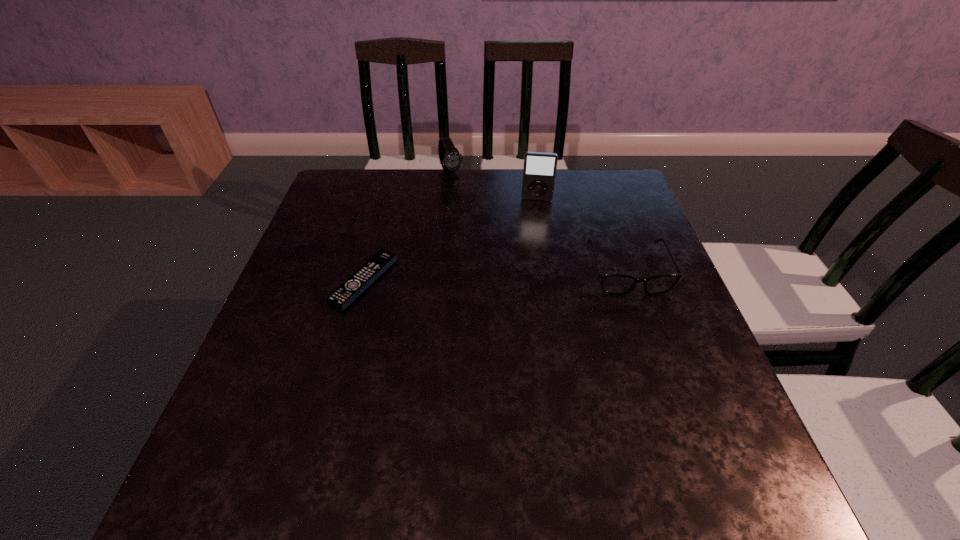
The image size is (960, 540). In order to click on free space between the spectacles and the tallest object in this screenshot , I will do `click(582, 235)`.

Identify the location of empty space between the watch and the remote control. The image size is (960, 540). (408, 229).

Where is `empty location between the third object from right to left and the remote control`? The height and width of the screenshot is (540, 960). empty location between the third object from right to left and the remote control is located at coordinates (408, 229).

At what (x,y) coordinates should I click in order to perform the action: click on blank region between the third object from right to left and the rightmost object. Please return your answer as a coordinate pair (x, y). Image resolution: width=960 pixels, height=540 pixels. Looking at the image, I should click on (540, 224).

Image resolution: width=960 pixels, height=540 pixels. What are the coordinates of `free space between the remote control and the third object from right to left` in the screenshot? It's located at click(408, 229).

You are a GUI agent. You are given a task and a screenshot of the screen. Output one action in this format:
    pyautogui.click(x=<x>, y=<y>)
    Task: Click on the object that is the closest to the watch
    This screenshot has width=960, height=540.
    Given the screenshot: What is the action you would take?
    pyautogui.click(x=539, y=172)

Identify the location of object that is the nearest to the spectacles. (539, 172).

Where is `vacant space that satisfies the following two spatial constraints: 1. on the back side of the shortest object; 2. on the left side of the second tallest object`? vacant space that satisfies the following two spatial constraints: 1. on the back side of the shortest object; 2. on the left side of the second tallest object is located at coordinates (392, 177).